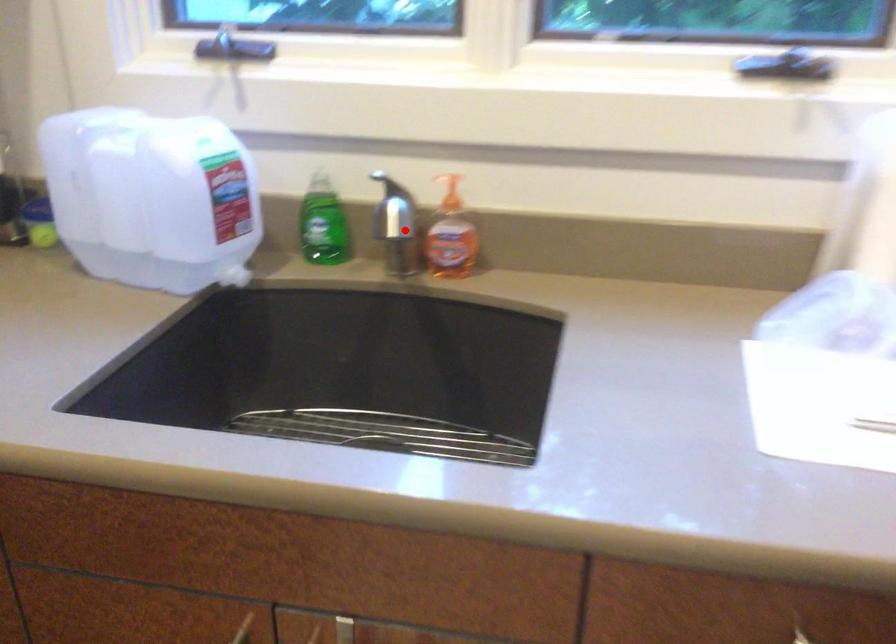
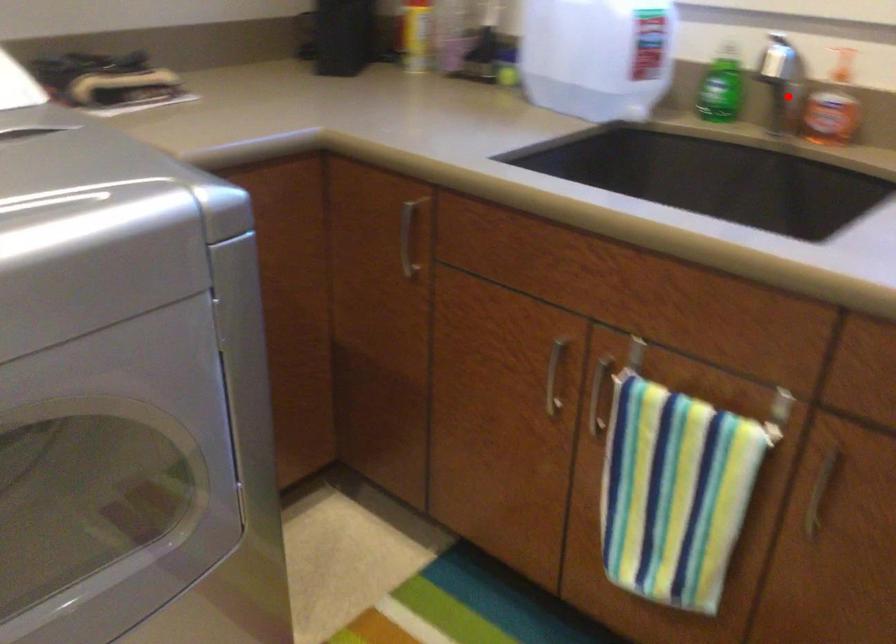
I am providing you with two images of the same scene from different viewpoints. A red point is marked on the first image and another point is marked on the second image. Is the marked point in image1 the same physical position as the marked point in image2?

Yes